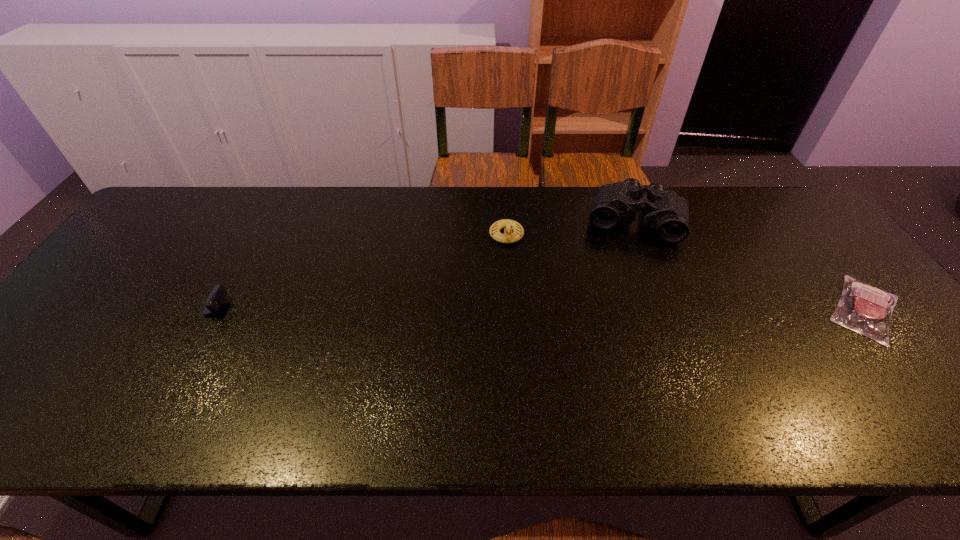
Where is `vacant space at the far edge of the desktop`? The width and height of the screenshot is (960, 540). vacant space at the far edge of the desktop is located at coordinates (487, 224).

Where is `free region at the near edge`? This screenshot has height=540, width=960. free region at the near edge is located at coordinates (592, 385).

Where is `free spot at the right edge of the desktop`? Image resolution: width=960 pixels, height=540 pixels. free spot at the right edge of the desktop is located at coordinates (804, 256).

Find the location of a particular element. vacant space at the far left corner of the desktop is located at coordinates (185, 218).

You are a GUI agent. You are given a task and a screenshot of the screen. Output one action in this format:
    pyautogui.click(x=<x>, y=<y>)
    Task: Click on the vacant region at the near left corner of the desktop
    The height and width of the screenshot is (540, 960).
    Given the screenshot: What is the action you would take?
    pyautogui.click(x=55, y=378)

Locate an element on the screen. Image resolution: width=960 pixels, height=540 pixels. free space at the far right corner of the desktop is located at coordinates (808, 216).

At what (x,y) coordinates should I click in order to perform the action: click on free space between the rightmost object and the third object from left to right. Please return your answer as a coordinate pair (x, y). This screenshot has width=960, height=540. Looking at the image, I should click on (750, 265).

Where is `unoccupied position between the steak and the third object from left to right`? The image size is (960, 540). unoccupied position between the steak and the third object from left to right is located at coordinates (750, 265).

Where is `vacant region between the third object from left to right and the rightmost object`? This screenshot has height=540, width=960. vacant region between the third object from left to right and the rightmost object is located at coordinates (750, 265).

Where is `free space between the shortest object and the binoculars`? The height and width of the screenshot is (540, 960). free space between the shortest object and the binoculars is located at coordinates (750, 265).